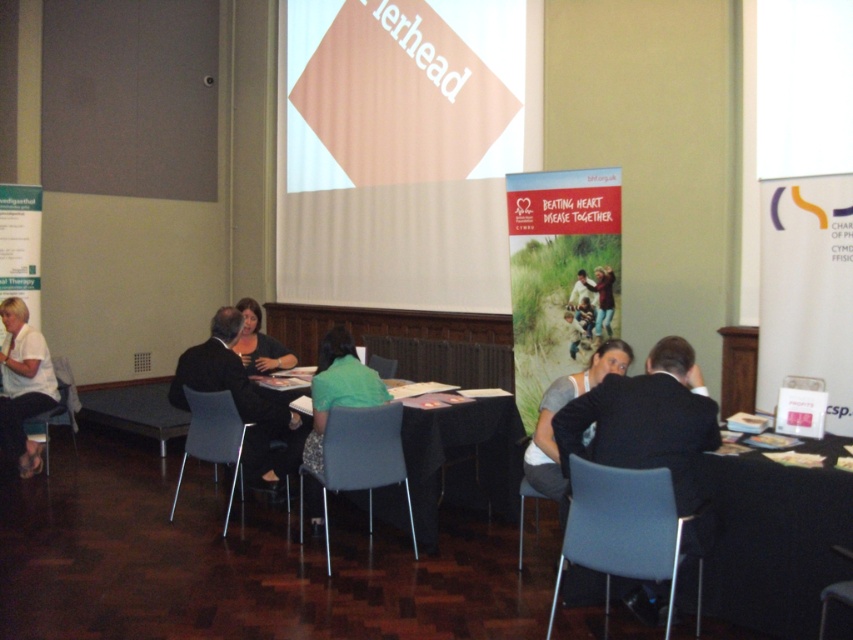
You are a guest attending a meeting in this room and want to sit down. You see the matte gray chair at lower right and the green fabric shirt at center. Which object is positioned to the right of the other?

The matte gray chair at lower right is to the right of the green fabric shirt at center.

You are standing in the conference room and need to place a small plant between the two points, point (662, 512) and point (325, 364). Which point should the plant be closer to in order to be placed closer to the viewer?

The plant should be placed closer to point (662, 512) because it is closer to the viewer than point (325, 364).

You are a photographer positioned at the entrance of the conference room. You need to capture a photo where both the white cotton shirt at center and the metallic gray chair at center are visible. Based on their positions, which object should be placed to the right side of the frame to ensure both are in the shot?

The white cotton shirt at center is to the right of the metallic gray chair at center. To include both in the photo, position the metallic gray chair at center on the left side of the frame, allowing the white cotton shirt at center to naturally fall to the right side.